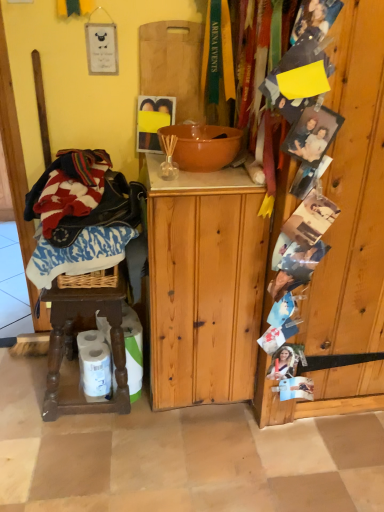
Question: Is brown wooden stool at lower left positioned with its back to wooden photo display at right?

Choices:
 (A) yes
 (B) no

Answer: (B)

Question: Is brown wooden stool at lower left thinner than wooden photo display at right?

Choices:
 (A) no
 (B) yes

Answer: (A)

Question: Is brown wooden stool at lower left to the right of wooden photo display at right from the viewer's perspective?

Choices:
 (A) yes
 (B) no

Answer: (B)

Question: Is brown wooden stool at lower left not close to wooden photo display at right?

Choices:
 (A) no
 (B) yes

Answer: (A)

Question: From a real-world perspective, is brown wooden stool at lower left located beneath wooden photo display at right?

Choices:
 (A) yes
 (B) no

Answer: (A)

Question: From a real-world perspective, is wooden cutting board at upper center above or below wooden photo display at right?

Choices:
 (A) below
 (B) above

Answer: (B)

Question: Looking at their shapes, would you say wooden cutting board at upper center is wider or thinner than wooden photo display at right?

Choices:
 (A) wide
 (B) thin

Answer: (B)

Question: Is point (180, 89) closer or farther from the camera than point (374, 193)?

Choices:
 (A) closer
 (B) farther

Answer: (B)

Question: From the image's perspective, is wooden cutting board at upper center above or below wooden photo display at right?

Choices:
 (A) above
 (B) below

Answer: (A)

Question: Considering the relative positions of natural wood cabinet at center and wooden cutting board at upper center in the image provided, is natural wood cabinet at center to the left or to the right of wooden cutting board at upper center?

Choices:
 (A) left
 (B) right

Answer: (B)

Question: From a real-world perspective, relative to wooden cutting board at upper center, is natural wood cabinet at center vertically above or below?

Choices:
 (A) above
 (B) below

Answer: (B)

Question: Is point (244, 322) positioned closer to the camera than point (168, 48)?

Choices:
 (A) farther
 (B) closer

Answer: (B)

Question: Is natural wood cabinet at center inside or outside of wooden cutting board at upper center?

Choices:
 (A) outside
 (B) inside

Answer: (A)

Question: Is natural wood cabinet at center taller or shorter than wooden photo display at right?

Choices:
 (A) tall
 (B) short

Answer: (B)

Question: Is natural wood cabinet at center wider or thinner than wooden photo display at right?

Choices:
 (A) wide
 (B) thin

Answer: (A)